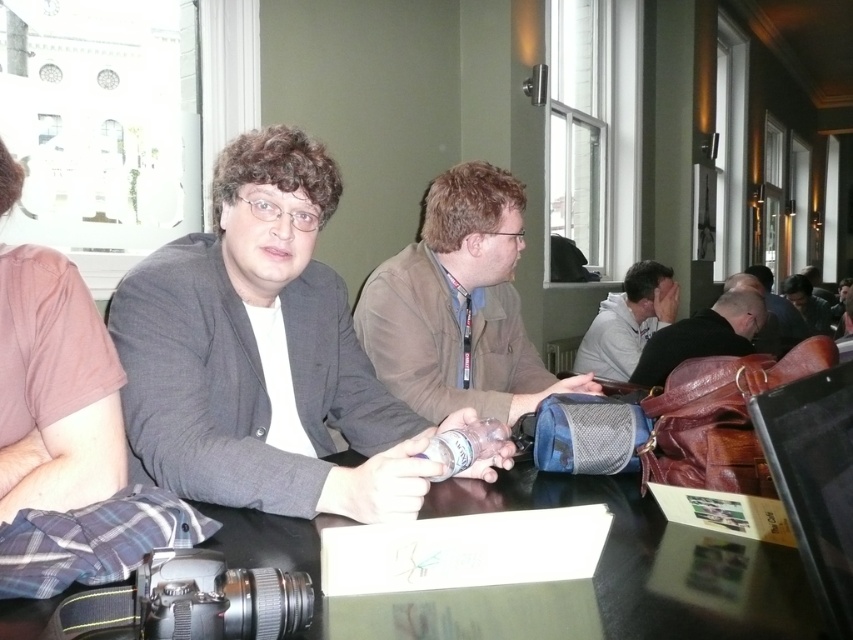
Question: Does matte gray blazer at center have a greater width compared to light gray hoodie at center?

Choices:
 (A) yes
 (B) no

Answer: (A)

Question: Can you confirm if light gray hoodie at center is wider than matte black jacket at center?

Choices:
 (A) yes
 (B) no

Answer: (B)

Question: Is light gray hoodie at center positioned before matte black jacket at center?

Choices:
 (A) no
 (B) yes

Answer: (B)

Question: Which object is positioned closest to the matte gray blazer at center?

Choices:
 (A) brown cotton shirt at left
 (B) black glossy table at center

Answer: (A)

Question: Which of the following is the closest to the observer?

Choices:
 (A) pos(779,298)
 (B) pos(726,314)
 (C) pos(485,250)
 (D) pos(596,324)

Answer: (C)

Question: Which point is closer to the camera?

Choices:
 (A) light gray hoodie at center
 (B) matte gray blazer at center
 (C) brown cotton shirt at left
 (D) dark brown leather jacket at center

Answer: (C)